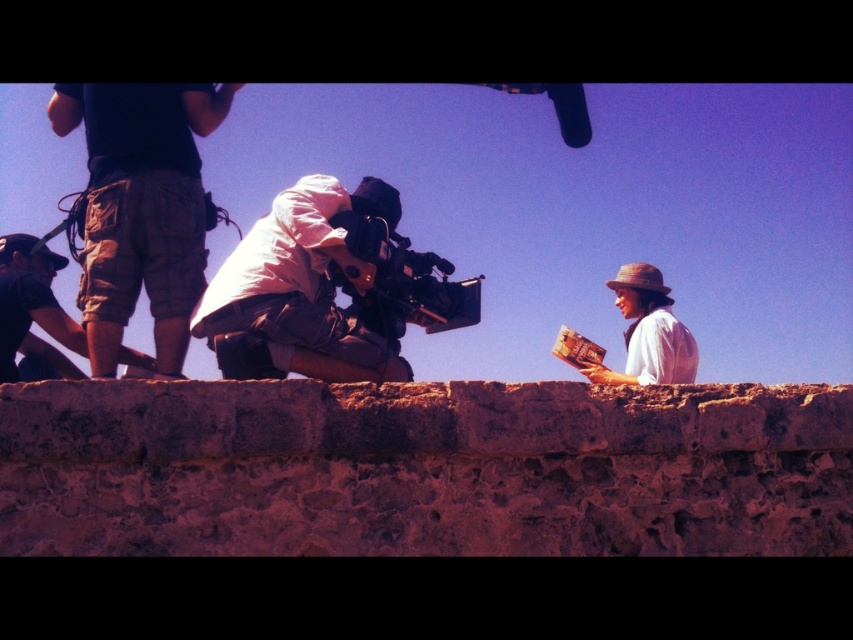
You are a production assistant on set and need to set up a monitor between the matte white camera at center and the black matte video camera at center. Which side should you place the monitor so it is between them?

The matte white camera at center is positioned on the left side of the black matte video camera at center, so placing the monitor to the right of the matte white camera at center and to the left of the black matte video camera at center would place it between them.

You are a production assistant needing to move a 5.5 feet wide equipment cart between the matte white camera at center and the black matte video camera at center. Can the cart fit through the space between them?

The distance between the matte white camera at center and the black matte video camera at center is 7.37 feet, which is wider than the 5.5 feet width of the equipment cart. Therefore, the cart can fit through the space between them.